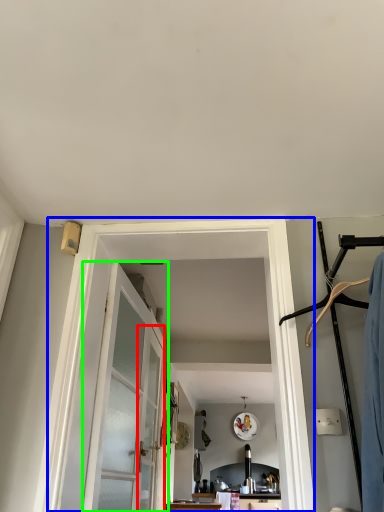
Question: Based on their relative distances, which object is farther from screen door (highlighted by a red box)? Choose from barn door (highlighted by a blue box) and door (highlighted by a green box).

Choices:
 (A) barn door
 (B) door

Answer: (A)